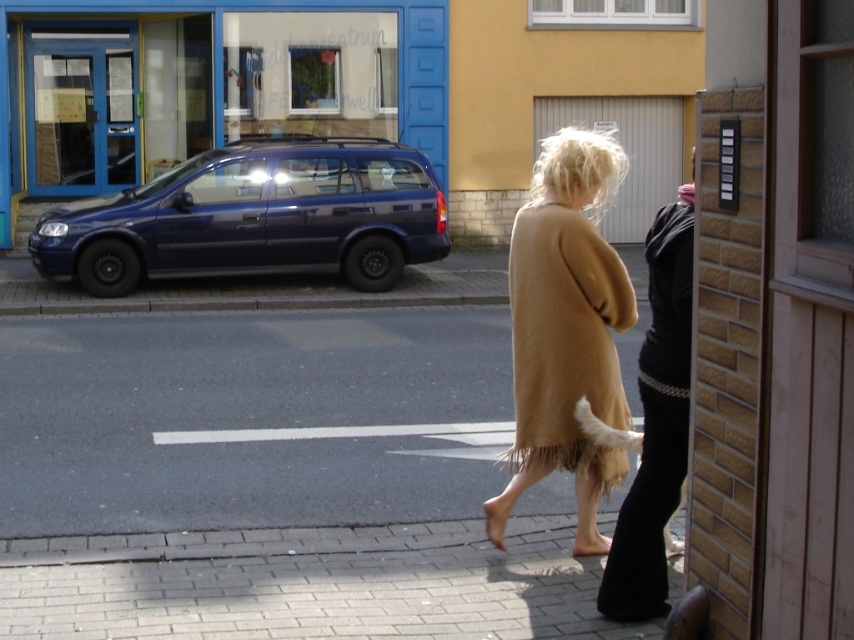
Who is more distant from viewer, (466, 506) or (671, 385)?

Point (466, 506)

Is smooth concrete pavement at lower center bigger than brown suede coat at center?

Correct, smooth concrete pavement at lower center is larger in size than brown suede coat at center.

Does point (472, 330) come closer to viewer compared to point (648, 536)?

No, it is behind (648, 536).

Identify the location of smooth concrete pavement at lower center. pyautogui.click(x=250, y=419).

Consider the image. Can you confirm if smooth concrete pavement at lower center is positioned to the left of beige fringed coat at center?

Correct, you'll find smooth concrete pavement at lower center to the left of beige fringed coat at center.

Can you confirm if smooth concrete pavement at lower center is thinner than beige fringed coat at center?

No.

Is point (173, 317) behind point (559, 179)?

Yes.

Locate an element on the screen. The width and height of the screenshot is (854, 640). smooth concrete pavement at lower center is located at coordinates (250, 419).

Does point (316, 180) come behind point (530, 316)?

That is True.

Which of these two, glossy blue minivan at left or beige fringed coat at center, stands shorter?

beige fringed coat at center is shorter.

Is point (71, 236) closer to viewer compared to point (542, 340)?

That is False.

Find the location of `glossy blue minivan at left`. glossy blue minivan at left is located at coordinates (255, 218).